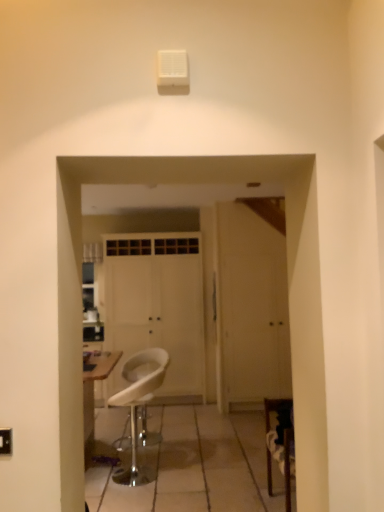
This screenshot has width=384, height=512. Describe the element at coordinates (251, 306) in the screenshot. I see `white matte door at center, which is the first door in right-to-left order` at that location.

Image resolution: width=384 pixels, height=512 pixels. I want to click on white matte door at center, the 2th door from the right, so click(x=157, y=306).

The height and width of the screenshot is (512, 384). What are the coordinates of `door in front of the white matte door at center, marked as the 1th door in a left-to-right arrangement` in the screenshot? It's located at (251, 306).

In the image, is white matte door at center, which is the first door in right-to-left order, positioned in front of or behind white matte door at center, the 2th door from the right?

Clearly, white matte door at center, which is the first door in right-to-left order, is in front of white matte door at center, the 2th door from the right.

Which point is more distant from viewer, [222,287] or [124,246]?

The point [124,246] is farther.

Is white matte door at center, placed as the second door when sorted from left to right, surrounding white matte door at center, the 2th door from the right?

Definitely not — white matte door at center, the 2th door from the right, is not inside white matte door at center, placed as the second door when sorted from left to right.

Is white plastic stool at center looking in the opposite direction of white matte door at center, marked as the 1th door in a left-to-right arrangement?

No, white plastic stool at center is not facing the opposite direction of white matte door at center, marked as the 1th door in a left-to-right arrangement.

Is white plastic stool at center taller than white matte door at center, marked as the 1th door in a left-to-right arrangement?

In fact, white plastic stool at center may be shorter than white matte door at center, marked as the 1th door in a left-to-right arrangement.

In the image, is white plastic stool at center on the left side or the right side of white matte door at center, the 2th door from the right?

Based on their positions, white plastic stool at center is located to the right of white matte door at center, the 2th door from the right.

Consider the image. Which is more distant, (121, 404) or (126, 251)?

The point (126, 251) is more distant.

Consider the image. How distant is white matte door at center, the 2th door from the right, from white matte door at center, placed as the second door when sorted from left to right?

white matte door at center, the 2th door from the right, and white matte door at center, placed as the second door when sorted from left to right, are 33.91 inches apart from each other.

Where is `door below the white matte door at center, the 2th door from the right (from a real-world perspective)`? Image resolution: width=384 pixels, height=512 pixels. door below the white matte door at center, the 2th door from the right (from a real-world perspective) is located at coordinates (251, 306).

Is white matte door at center, marked as the 1th door in a left-to-right arrangement, wider or thinner than white matte door at center, placed as the second door when sorted from left to right?

Considering their sizes, white matte door at center, marked as the 1th door in a left-to-right arrangement, looks broader than white matte door at center, placed as the second door when sorted from left to right.

Who is taller, white matte door at center, marked as the 1th door in a left-to-right arrangement, or white matte door at center, placed as the second door when sorted from left to right?

Standing taller between the two is white matte door at center, marked as the 1th door in a left-to-right arrangement.

Based on the photo, is white matte door at center, marked as the 1th door in a left-to-right arrangement, looking in the opposite direction of white plastic stool at center?

No, white plastic stool at center is not at the back of white matte door at center, marked as the 1th door in a left-to-right arrangement.

From the picture: From the image's perspective, which is above, white matte door at center, marked as the 1th door in a left-to-right arrangement, or white plastic stool at center?

white matte door at center, marked as the 1th door in a left-to-right arrangement, appears higher in the image.

Does white matte door at center, the 2th door from the right, have a lesser height compared to white plastic stool at center?

No.

Does white matte door at center, marked as the 1th door in a left-to-right arrangement, contain white plastic stool at center?

No, white plastic stool at center is not inside white matte door at center, marked as the 1th door in a left-to-right arrangement.

Which is more to the left, white plastic stool at center or white matte door at center, which is the first door in right-to-left order?

Positioned to the left is white plastic stool at center.

Is white plastic stool at center behind white matte door at center, which is the first door in right-to-left order?

No, white plastic stool at center is closer to the camera.

From the image's perspective, is white plastic stool at center located above white matte door at center, placed as the second door when sorted from left to right?

No, from the image's perspective, white plastic stool at center is not over white matte door at center, placed as the second door when sorted from left to right.

This screenshot has height=512, width=384. Find the location of `door on the right side of white plastic stool at center`. door on the right side of white plastic stool at center is located at coordinates (251, 306).

Would you consider white matte door at center, placed as the second door when sorted from left to right, to be distant from white plastic stool at center?

Absolutely, white matte door at center, placed as the second door when sorted from left to right, is distant from white plastic stool at center.

From a real-world perspective, is white matte door at center, which is the first door in right-to-left order, under white plastic stool at center?

Incorrect, from a real-world perspective, white matte door at center, which is the first door in right-to-left order, is higher than white plastic stool at center.

You are a GUI agent. You are given a task and a screenshot of the screen. Output one action in this format:
    pyautogui.click(x=<x>, y=<y>)
    Task: Click on the chair on the left of white matte door at center, which is the first door in right-to-left order
    This screenshot has height=512, width=384.
    Given the screenshot: What is the action you would take?
    pyautogui.click(x=139, y=404)

Who is taller, white matte door at center, which is the first door in right-to-left order, or white plastic stool at center?

Standing taller between the two is white matte door at center, which is the first door in right-to-left order.

Image resolution: width=384 pixels, height=512 pixels. In order to click on door that appears on the right of white matte door at center, marked as the 1th door in a left-to-right arrangement in this screenshot , I will do `click(251, 306)`.

From the image's perspective, which door is the 2nd one above the white plastic stool at center? Please provide its 2D coordinates.

[(157, 306)]

Estimate the real-world distances between objects in this image. Which object is closer to white matte door at center, marked as the 1th door in a left-to-right arrangement, white plastic stool at center or white matte door at center, placed as the second door when sorted from left to right?

The object closer to white matte door at center, marked as the 1th door in a left-to-right arrangement, is white matte door at center, placed as the second door when sorted from left to right.

Which object lies further to the anchor point white matte door at center, which is the first door in right-to-left order, white plastic stool at center or white matte door at center, the 2th door from the right?

The object further to white matte door at center, which is the first door in right-to-left order, is white plastic stool at center.

From the image, which object appears to be farther from white plastic stool at center, white matte door at center, the 2th door from the right, or white matte door at center, placed as the second door when sorted from left to right?

white matte door at center, placed as the second door when sorted from left to right, is positioned further to the anchor white plastic stool at center.

Considering their positions, is white matte door at center, which is the first door in right-to-left order, positioned further to white plastic stool at center than white matte door at center, the 2th door from the right?

white matte door at center, which is the first door in right-to-left order, lies further to white plastic stool at center than the other object.

Which object lies further to the anchor point white matte door at center, the 2th door from the right, white matte door at center, placed as the second door when sorted from left to right, or white plastic stool at center?

The object further to white matte door at center, the 2th door from the right, is white plastic stool at center.

From the picture: Considering their positions, is white matte door at center, marked as the 1th door in a left-to-right arrangement, positioned closer to white matte door at center, placed as the second door when sorted from left to right, than white plastic stool at center?

white matte door at center, marked as the 1th door in a left-to-right arrangement, is closer to white matte door at center, placed as the second door when sorted from left to right.

This screenshot has width=384, height=512. What are the coordinates of `door between white plastic stool at center and white matte door at center, marked as the 1th door in a left-to-right arrangement, from front to back` in the screenshot? It's located at (251, 306).